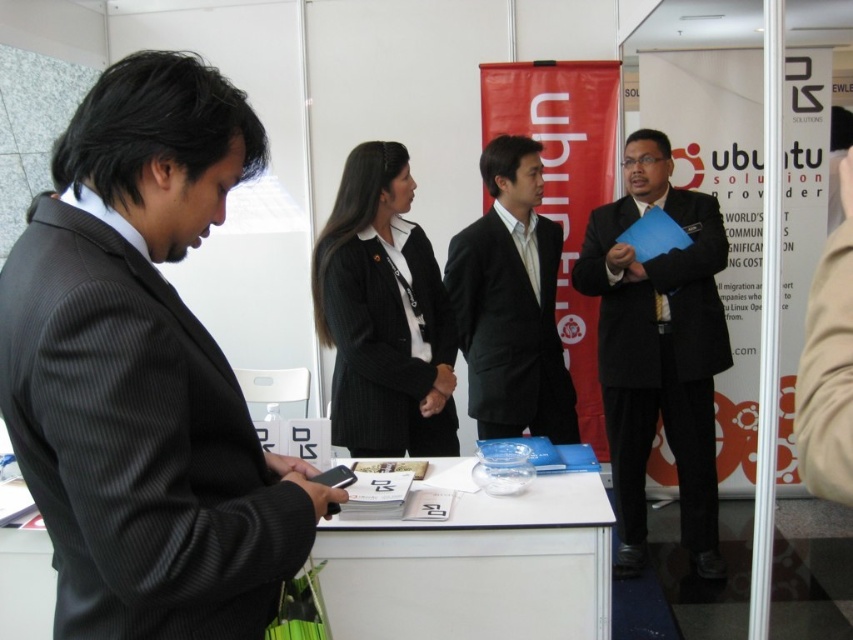
You are a photographer at the event and need to capture a photo that includes both the black pinstripe suit at left and the matte black suit at center. Based on their distance, can you fit both into the frame without moving the camera?

The black pinstripe suit at left is 2.15 meters away from the matte black suit at center. Since the distance between them is fixed, you can adjust the camera zoom to ensure both are within the frame without needing to move the camera position.